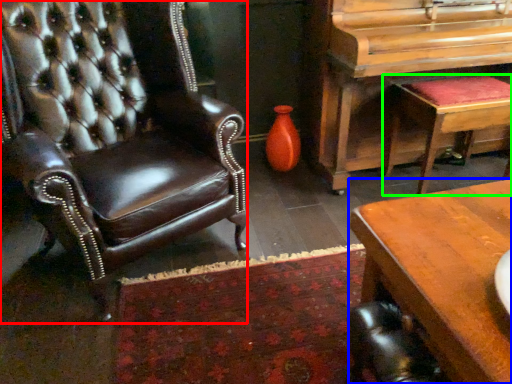
Question: Based on their relative distances, which object is farther from chair (highlighted by a red box)? Choose from desk (highlighted by a blue box) and stool (highlighted by a green box).

Choices:
 (A) desk
 (B) stool

Answer: (B)